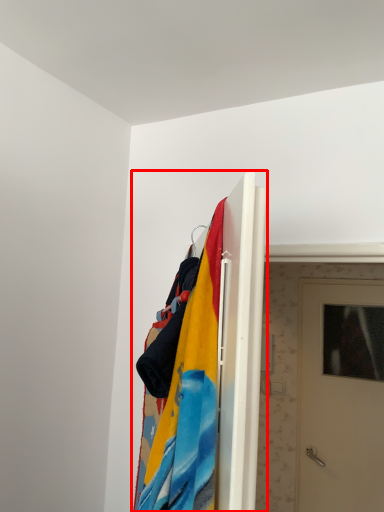
Question: From the image's perspective, where is closet (annotated by the red box) located relative to door?

Choices:
 (A) below
 (B) above

Answer: (B)